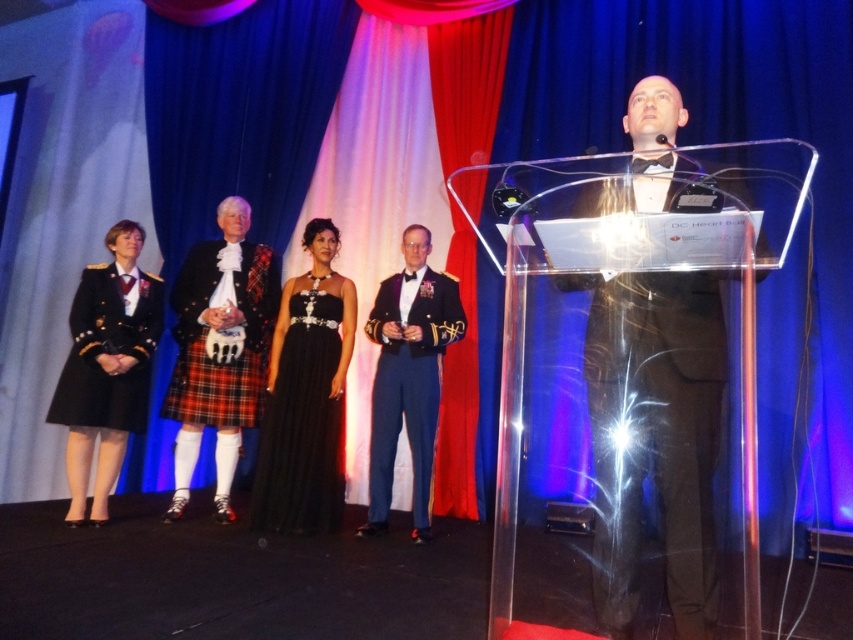
Question: Which point appears farthest from the camera in this image?

Choices:
 (A) (660, 108)
 (B) (312, 336)
 (C) (65, 369)

Answer: (B)

Question: Does black satin dress at center appear on the right side of dark blue wool dress at left?

Choices:
 (A) no
 (B) yes

Answer: (B)

Question: Which point is farther to the camera?

Choices:
 (A) black satin dress at center
 (B) dark blue wool dress at left
 (C) shiny blue uniform at center
 (D) red plaid kilt at center

Answer: (D)

Question: Does red plaid kilt at center have a greater width compared to black satin dress at center?

Choices:
 (A) no
 (B) yes

Answer: (B)

Question: Which of the following is the closest to the observer?

Choices:
 (A) red plaid kilt at center
 (B) black satin dress at center
 (C) dark blue wool dress at left
 (D) black tuxedo at center

Answer: (D)

Question: Is shiny blue uniform at center below dark blue wool dress at left?

Choices:
 (A) no
 (B) yes

Answer: (B)